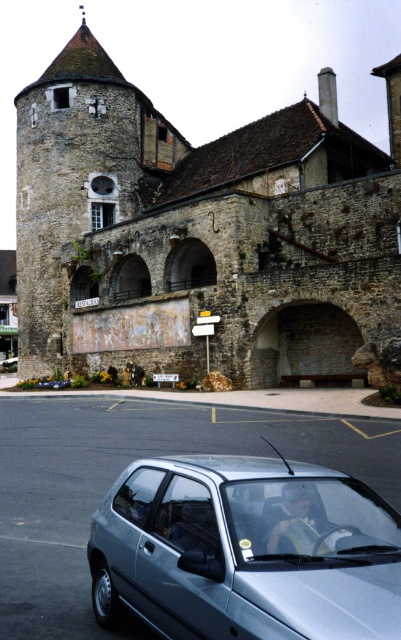
Which is above, satin silver car at lower center or white plastic license plate at center?

satin silver car at lower center is higher up.

Looking at this image, which is more to the right, satin silver car at lower center or white plastic license plate at center?

satin silver car at lower center is more to the right.

You are a GUI agent. You are given a task and a screenshot of the screen. Output one action in this format:
    pyautogui.click(x=<x>, y=<y>)
    Task: Click on the satin silver car at lower center
    The width and height of the screenshot is (401, 640).
    Given the screenshot: What is the action you would take?
    pyautogui.click(x=245, y=550)

Between stone tower at center and white plastic license plate at center, which one appears on the right side from the viewer's perspective?

Positioned to the right is white plastic license plate at center.

Does point (168, 259) come behind point (155, 372)?

Yes, it is.

The width and height of the screenshot is (401, 640). In order to click on stone tower at center in this screenshot , I will do `click(200, 234)`.

Between stone tower at center and satin silver car at lower center, which one appears on the left side from the viewer's perspective?

stone tower at center

Which of these two, stone tower at center or satin silver car at lower center, stands shorter?

With less height is satin silver car at lower center.

Where is `stone tower at center`? The height and width of the screenshot is (640, 401). stone tower at center is located at coordinates (200, 234).

At what (x,y) coordinates should I click in order to perform the action: click on stone tower at center. Please return your answer as a coordinate pair (x, y). Image resolution: width=401 pixels, height=640 pixels. Looking at the image, I should click on (200, 234).